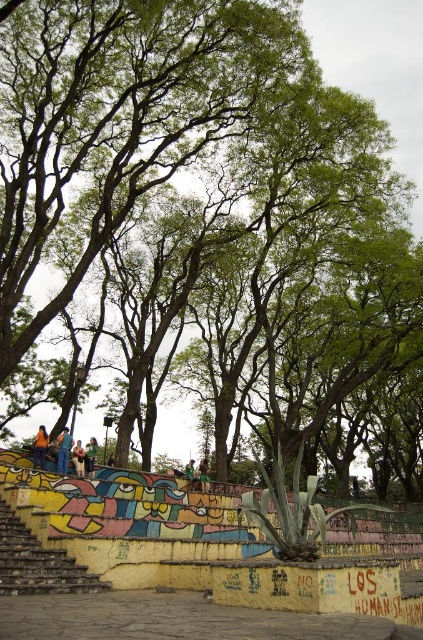
You are an observer standing in front of the tree and the mural. You see an orange fabric person at lower left and a green fabric shirt at lower left. Which object is more to the left?

The orange fabric person at lower left is more to the left.

You are standing in the outdoor scene and see both the green fabric shirt at lower left and the light brown leather jacket at lower left. Which clothing item is positioned higher on the wall?

The green fabric shirt at lower left is above the light brown leather jacket at lower left, so it is positioned higher on the wall.